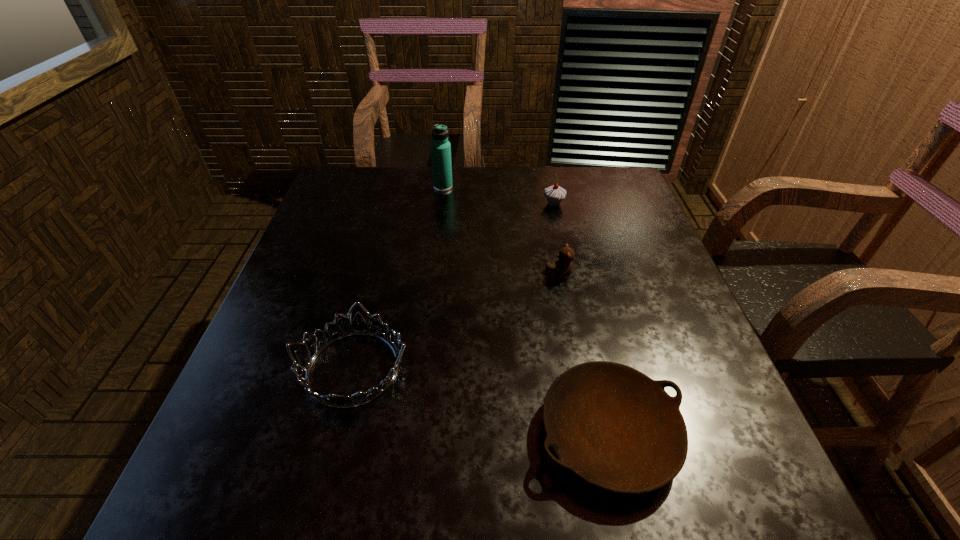
I want to click on vacant area at the far edge of the desktop, so click(x=422, y=196).

You are a GUI agent. You are given a task and a screenshot of the screen. Output one action in this format:
    pyautogui.click(x=<x>, y=<y>)
    Task: Click on the vacant region at the near edge of the desktop
    The width and height of the screenshot is (960, 540).
    Given the screenshot: What is the action you would take?
    tap(569, 481)

You are a GUI agent. You are given a task and a screenshot of the screen. Output one action in this format:
    pyautogui.click(x=<x>, y=<y>)
    Task: Click on the vacant space at the left edge
    Image resolution: width=960 pixels, height=540 pixels.
    Given the screenshot: What is the action you would take?
    pyautogui.click(x=354, y=212)

Where is `free space at the right edge of the desktop`? free space at the right edge of the desktop is located at coordinates (662, 295).

The height and width of the screenshot is (540, 960). In the image, there is a desktop. What are the coordinates of `vacant space at the far left corner` in the screenshot? It's located at (358, 168).

You are a GUI agent. You are given a task and a screenshot of the screen. Output one action in this format:
    pyautogui.click(x=<x>, y=<y>)
    Task: Click on the vacant position at the near left corner of the desktop
    
    Given the screenshot: What is the action you would take?
    pyautogui.click(x=215, y=461)

Locate an element on the screen. Image resolution: width=960 pixels, height=540 pixels. vacant space that is in between the tallest object and the third farthest object is located at coordinates (501, 231).

Where is `vacant area that lies between the teddy bear and the second farthest object`? This screenshot has height=540, width=960. vacant area that lies between the teddy bear and the second farthest object is located at coordinates (557, 239).

The height and width of the screenshot is (540, 960). I want to click on free point between the farthest object and the tiara, so click(398, 278).

This screenshot has height=540, width=960. In order to click on free spot between the teddy bear and the plate in this screenshot , I will do `click(584, 355)`.